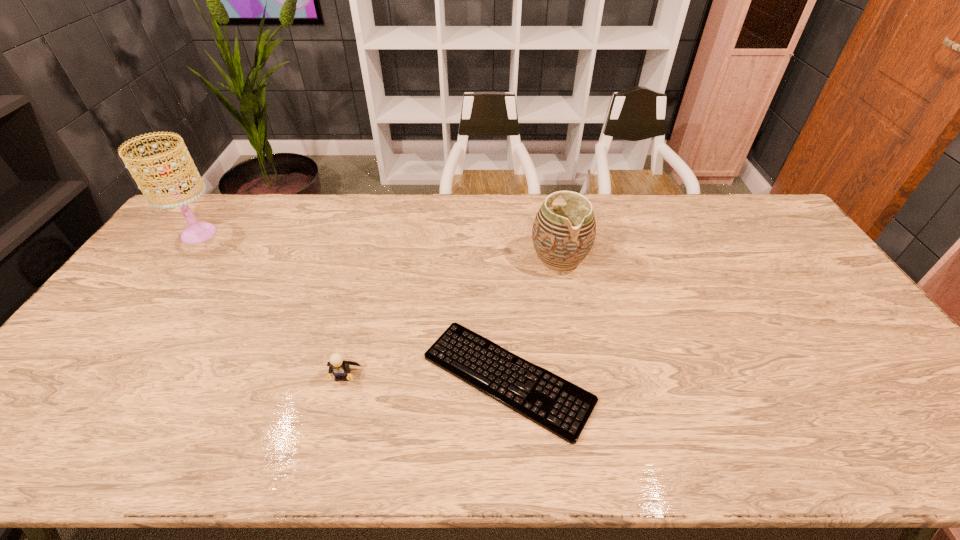
Point out which object is positioned as the second nearest to the computer keyboard. Please provide its 2D coordinates. Your answer should be formatted as a tuple, i.e. [(x, y)], where the tuple contains the x and y coordinates of a point satisfying the conditions above.

[(563, 235)]

You are a GUI agent. You are given a task and a screenshot of the screen. Output one action in this format:
    pyautogui.click(x=<x>, y=<y>)
    Task: Click on the free location that satisfies the following two spatial constraints: 1. on the front-facing side of the computer keyboard; 2. on the left side of the Lego
    The height and width of the screenshot is (540, 960).
    Given the screenshot: What is the action you would take?
    pyautogui.click(x=343, y=378)

Identify the location of free point that satisfies the following two spatial constraints: 1. on the back side of the computer keyboard; 2. on the left side of the pottery. (501, 259).

The image size is (960, 540). I want to click on free space that satisfies the following two spatial constraints: 1. on the front side of the leftmost object; 2. on the left side of the computer keyboard, so click(x=93, y=378).